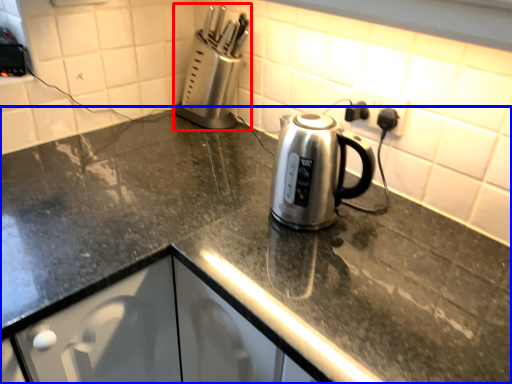
Question: Which of the following is the farthest to the observer, appliance (highlighted by a red box) or countertop (highlighted by a blue box)?

Choices:
 (A) appliance
 (B) countertop

Answer: (A)